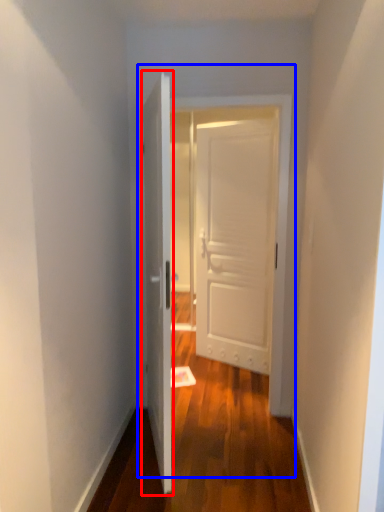
Question: Which of the following is the farthest to the observer, door (highlighted by a red box) or door (highlighted by a blue box)?

Choices:
 (A) door
 (B) door

Answer: (B)